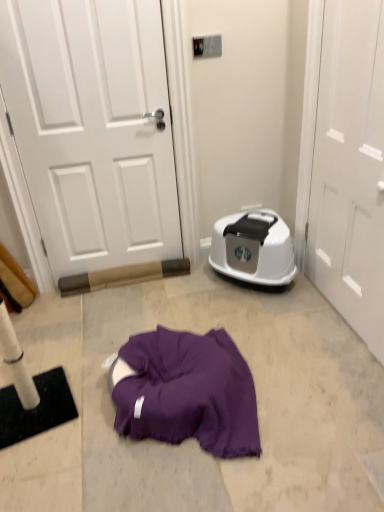
Question: Is white matte door at upper left, which is the 2th door from right to left, further to the viewer compared to white glossy door at right, the first door in the right-to-left sequence?

Choices:
 (A) yes
 (B) no

Answer: (A)

Question: Does white matte door at upper left, which is the 2th door from right to left, contain white glossy door at right, the first door in the right-to-left sequence?

Choices:
 (A) yes
 (B) no

Answer: (B)

Question: Can you confirm if white matte door at upper left, which is the 2th door from right to left, is positioned to the right of white glossy door at right, the first door in the right-to-left sequence?

Choices:
 (A) no
 (B) yes

Answer: (A)

Question: Does white matte door at upper left, which is the 2th door from right to left, have a smaller size compared to white glossy door at right, the second door from the left?

Choices:
 (A) yes
 (B) no

Answer: (B)

Question: From a real-world perspective, is white matte door at upper left, which is counted as the 1th door, starting from the left, under white glossy door at right, the first door in the right-to-left sequence?

Choices:
 (A) yes
 (B) no

Answer: (B)

Question: Does white matte door at upper left, which is counted as the 1th door, starting from the left, lie in front of white glossy door at right, the second door from the left?

Choices:
 (A) no
 (B) yes

Answer: (A)

Question: Can you confirm if white glossy dishwasher at right is smaller than white matte door at upper left, which is counted as the 1th door, starting from the left?

Choices:
 (A) yes
 (B) no

Answer: (B)

Question: Does white glossy dishwasher at right appear on the left side of white matte door at upper left, which is counted as the 1th door, starting from the left?

Choices:
 (A) no
 (B) yes

Answer: (A)

Question: From the image's perspective, is white glossy dishwasher at right above white matte door at upper left, which is the 2th door from right to left?

Choices:
 (A) yes
 (B) no

Answer: (B)

Question: Is white glossy dishwasher at right thinner than white matte door at upper left, which is the 2th door from right to left?

Choices:
 (A) no
 (B) yes

Answer: (A)

Question: Does white glossy dishwasher at right turn towards white matte door at upper left, which is counted as the 1th door, starting from the left?

Choices:
 (A) no
 (B) yes

Answer: (A)

Question: Is white glossy dishwasher at right facing away from white matte door at upper left, which is counted as the 1th door, starting from the left?

Choices:
 (A) yes
 (B) no

Answer: (B)

Question: Is white glossy door at right, the second door from the left, closer to the viewer compared to white matte door at upper left, which is counted as the 1th door, starting from the left?

Choices:
 (A) no
 (B) yes

Answer: (B)